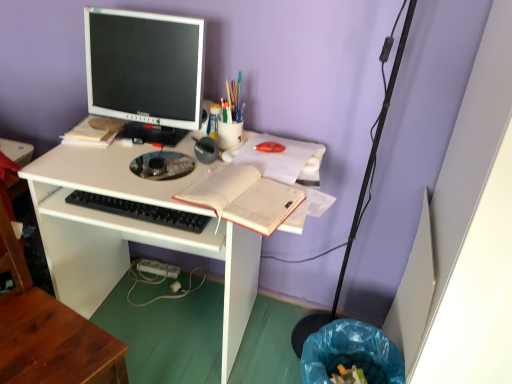
The image size is (512, 384). What are the coordinates of `free space in front of satin black monitor at upper left` in the screenshot? It's located at (103, 176).